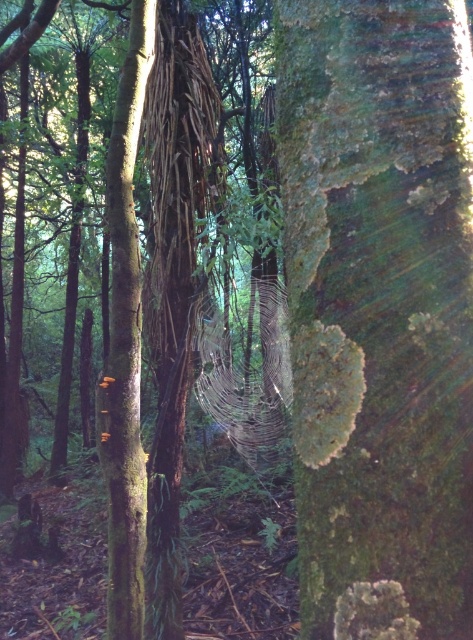
Can you confirm if green rough bark tree at center is positioned to the right of smooth brown tree trunk at left?

Indeed, green rough bark tree at center is positioned on the right side of smooth brown tree trunk at left.

Which is above, green rough bark tree at center or smooth brown tree trunk at left?

smooth brown tree trunk at left is above.

Which is behind, point (376, 196) or point (132, 378)?

Positioned behind is point (132, 378).

I want to click on green rough bark tree at center, so click(x=379, y=310).